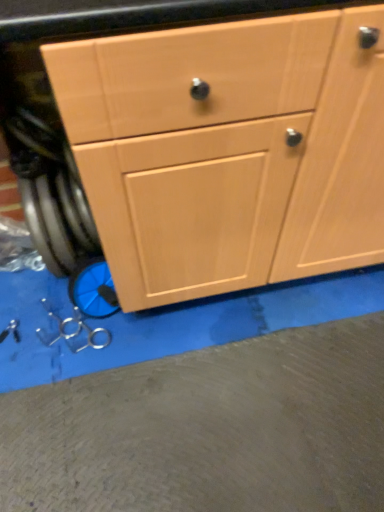
Locate an element on the screen. metallic scissors at lower left is located at coordinates (74, 331).

This screenshot has width=384, height=512. What do you see at coordinates (74, 331) in the screenshot? I see `metallic scissors at lower left` at bounding box center [74, 331].

Locate an element on the screen. The height and width of the screenshot is (512, 384). metallic scissors at lower left is located at coordinates (74, 331).